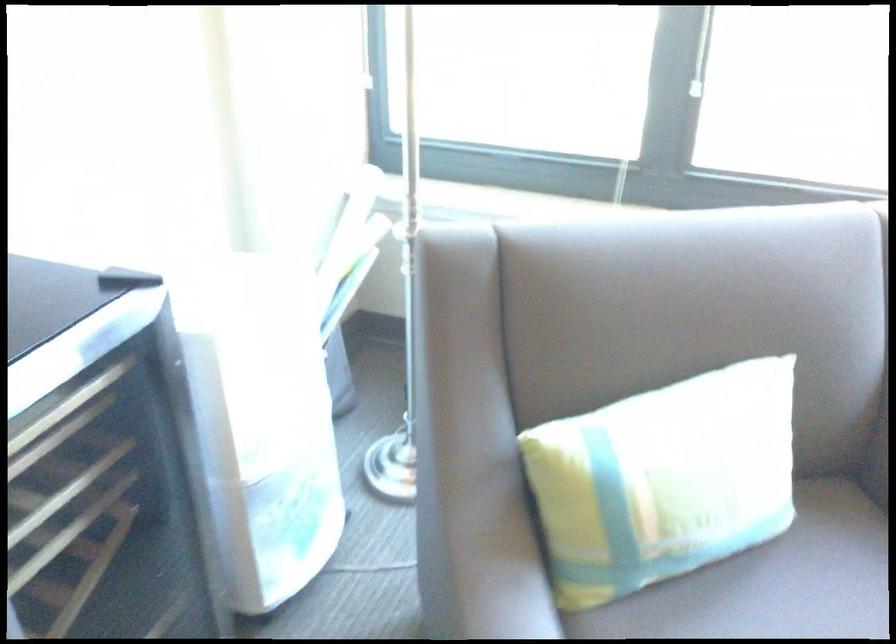
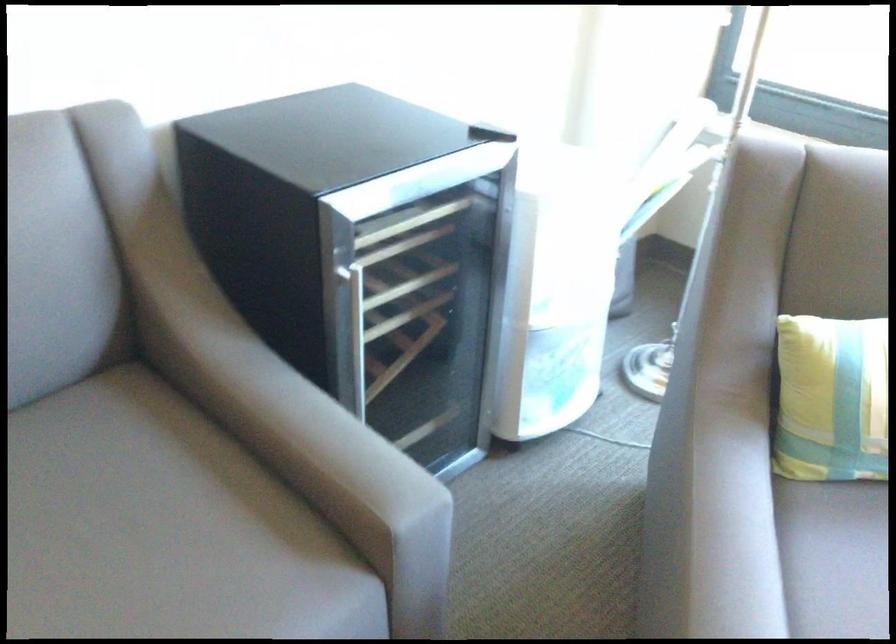
Where in the second image is the point corresponding to (601,511) from the first image?

(831, 399)